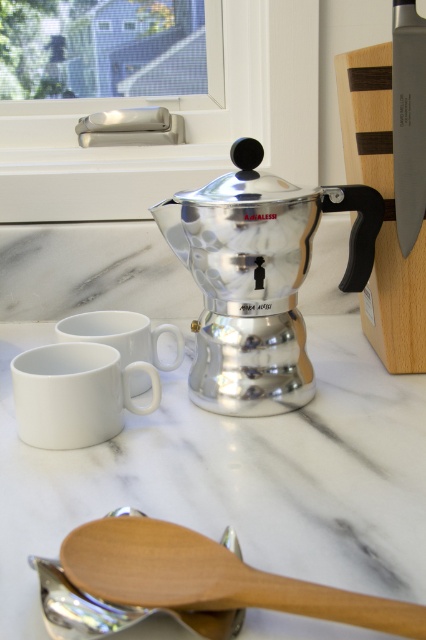
Question: Is shiny metallic coffee pot at center to the left of white glossy mug at lower left from the viewer's perspective?

Choices:
 (A) yes
 (B) no

Answer: (B)

Question: Which point is farther to the camera?

Choices:
 (A) (417, 605)
 (B) (238, 333)
 (C) (161, 628)
 (D) (20, 384)

Answer: (B)

Question: Does wooden spoon at center come behind white matte mug at center?

Choices:
 (A) yes
 (B) no

Answer: (B)

Question: Does white marble counter top at center appear on the left side of white matte mug at center?

Choices:
 (A) yes
 (B) no

Answer: (B)

Question: Which point is farther to the camera?

Choices:
 (A) (43, 412)
 (B) (275, 216)
 (C) (416, 605)
 (D) (120, 353)

Answer: (D)

Question: Among these points, which one is farthest from the camera?

Choices:
 (A) (296, 356)
 (B) (356, 612)
 (C) (408, 547)
 (D) (71, 349)

Answer: (D)